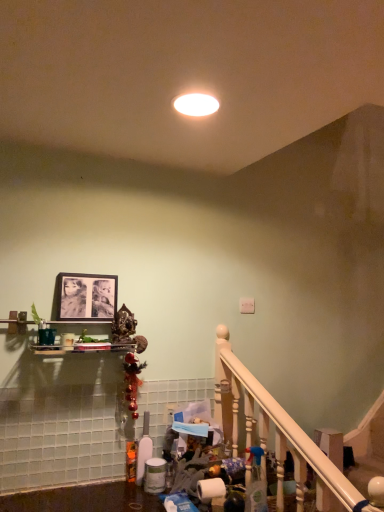
Locate an element on the screen. clear plastic spray bottle at lower center is located at coordinates (256, 483).

The image size is (384, 512). In order to click on matte black picture frame at upper center in this screenshot , I will do `click(85, 297)`.

You are a GUI agent. You are given a task and a screenshot of the screen. Output one action in this format:
    pyautogui.click(x=<x>, y=<y>)
    Task: Click on the white wooden railing at lower right
    The height and width of the screenshot is (512, 384).
    Given the screenshot: What is the action you would take?
    pyautogui.click(x=275, y=429)

In order to face white glossy light fixture at center, should I rotate leftwards or rightwards?

To face it directly, rotate right by 0.269 degrees.

The image size is (384, 512). Identify the location of clear plastic spray bottle at lower center. (256, 483).

Who is bigger, white glossy light fixture at center or clear plastic spray bottle at lower center?

Bigger between the two is clear plastic spray bottle at lower center.

Which object is positioned more to the right, white glossy light fixture at center or clear plastic spray bottle at lower center?

Positioned to the right is clear plastic spray bottle at lower center.

Is white glossy light fixture at center turned away from clear plastic spray bottle at lower center?

No.

Locate an element on the screen. The height and width of the screenshot is (512, 384). lighting on the left of clear plastic spray bottle at lower center is located at coordinates (196, 104).

Is matte black picture frame at upper center directly adjacent to white glossy light fixture at center?

matte black picture frame at upper center is not next to white glossy light fixture at center, and they're not touching.

Is matte black picture frame at upper center inside or outside of white glossy light fixture at center?

matte black picture frame at upper center is not inside white glossy light fixture at center, it's outside.

Is matte black picture frame at upper center positioned with its back to white glossy light fixture at center?

That's not correct — matte black picture frame at upper center is not looking away from white glossy light fixture at center.

How different are the orientations of matte black picture frame at upper center and white glossy light fixture at center in degrees?

They differ by 1.13 degrees in their facing directions.

From the image's perspective, is white glossy light fixture at center positioned above or below white wooden railing at lower right?

Clearly, from the image's perspective, white glossy light fixture at center is above white wooden railing at lower right.

Where is `rail below the white glossy light fixture at center (from the image's perspective)`? rail below the white glossy light fixture at center (from the image's perspective) is located at coordinates pos(275,429).

Is white glossy light fixture at center facing towards white wooden railing at lower right?

No, white glossy light fixture at center is not facing towards white wooden railing at lower right.

Are white glossy light fixture at center and white wooden railing at lower right located far from each other?

That's right, there is a large distance between white glossy light fixture at center and white wooden railing at lower right.

Based on the photo, is white glossy light fixture at center touching matte black picture frame at upper center?

white glossy light fixture at center and matte black picture frame at upper center are not in contact.

From a real-world perspective, between white glossy light fixture at center and matte black picture frame at upper center, who is vertically lower?

In real-world perspective, matte black picture frame at upper center is lower.

Is white glossy light fixture at center inside the boundaries of matte black picture frame at upper center, or outside?

white glossy light fixture at center cannot be found inside matte black picture frame at upper center.

Is white glossy light fixture at center oriented towards matte black picture frame at upper center?

No, white glossy light fixture at center does not turn towards matte black picture frame at upper center.

Is matte black picture frame at upper center oriented away from clear plastic spray bottle at lower center?

No, matte black picture frame at upper center's orientation is not away from clear plastic spray bottle at lower center.

Considering the relative sizes of matte black picture frame at upper center and clear plastic spray bottle at lower center in the image provided, is matte black picture frame at upper center wider than clear plastic spray bottle at lower center?

No.

In the image, is matte black picture frame at upper center positioned in front of or behind clear plastic spray bottle at lower center?

Clearly, matte black picture frame at upper center is behind clear plastic spray bottle at lower center.

Is white wooden railing at lower right shorter than matte black picture frame at upper center?

Incorrect, the height of white wooden railing at lower right does not fall short of that of matte black picture frame at upper center.

Measure the distance between white wooden railing at lower right and matte black picture frame at upper center.

30.69 inches.

Is white wooden railing at lower right surrounding matte black picture frame at upper center?

Definitely not — matte black picture frame at upper center is not inside white wooden railing at lower right.

Is point (255, 473) closer or farther from the camera than point (305, 474)?

Clearly, point (255, 473) is more distant from the camera than point (305, 474).

Between clear plastic spray bottle at lower center and white wooden railing at lower right, which one has larger width?

With larger width is white wooden railing at lower right.

Is clear plastic spray bottle at lower center positioned with its back to white wooden railing at lower right?

That's not correct — clear plastic spray bottle at lower center is not looking away from white wooden railing at lower right.

Is clear plastic spray bottle at lower center in contact with white wooden railing at lower right?

clear plastic spray bottle at lower center and white wooden railing at lower right are clearly separated.

The height and width of the screenshot is (512, 384). Find the location of `cleaning product on the right of white glossy light fixture at center`. cleaning product on the right of white glossy light fixture at center is located at coordinates (256, 483).

In order to click on lighting lying above the matte black picture frame at upper center (from the image's perspective) in this screenshot , I will do `click(196, 104)`.

Looking at the image, which one is located further to matte black picture frame at upper center, white wooden railing at lower right or clear plastic spray bottle at lower center?

clear plastic spray bottle at lower center.

Based on their spatial positions, is white glossy light fixture at center or white wooden railing at lower right further from clear plastic spray bottle at lower center?

white glossy light fixture at center lies further to clear plastic spray bottle at lower center than the other object.

In the scene shown: Considering their positions, is matte black picture frame at upper center positioned further to white glossy light fixture at center than white wooden railing at lower right?

white wooden railing at lower right is further to white glossy light fixture at center.

Considering their positions, is clear plastic spray bottle at lower center positioned further to white wooden railing at lower right than white glossy light fixture at center?

white glossy light fixture at center.

Which object lies nearer to the anchor point matte black picture frame at upper center, white wooden railing at lower right or white glossy light fixture at center?

Based on the image, white wooden railing at lower right appears to be nearer to matte black picture frame at upper center.

When comparing their distances from white wooden railing at lower right, does white glossy light fixture at center or matte black picture frame at upper center seem further?

The object further to white wooden railing at lower right is white glossy light fixture at center.

Which object lies further to the anchor point clear plastic spray bottle at lower center, white glossy light fixture at center or matte black picture frame at upper center?

The object further to clear plastic spray bottle at lower center is white glossy light fixture at center.

Considering their positions, is matte black picture frame at upper center positioned closer to white glossy light fixture at center than clear plastic spray bottle at lower center?

matte black picture frame at upper center.

This screenshot has height=512, width=384. What are the coordinates of `picture frame that lies between white glossy light fixture at center and white wooden railing at lower right from top to bottom` in the screenshot? It's located at (85, 297).

The image size is (384, 512). I want to click on rail that lies between white glossy light fixture at center and clear plastic spray bottle at lower center from top to bottom, so click(x=275, y=429).

Where is `picture frame between white glossy light fixture at center and clear plastic spray bottle at lower center in the up-down direction`? picture frame between white glossy light fixture at center and clear plastic spray bottle at lower center in the up-down direction is located at coordinates (85, 297).

Locate an element on the screen. cleaning product between matte black picture frame at upper center and white wooden railing at lower right from left to right is located at coordinates (256, 483).